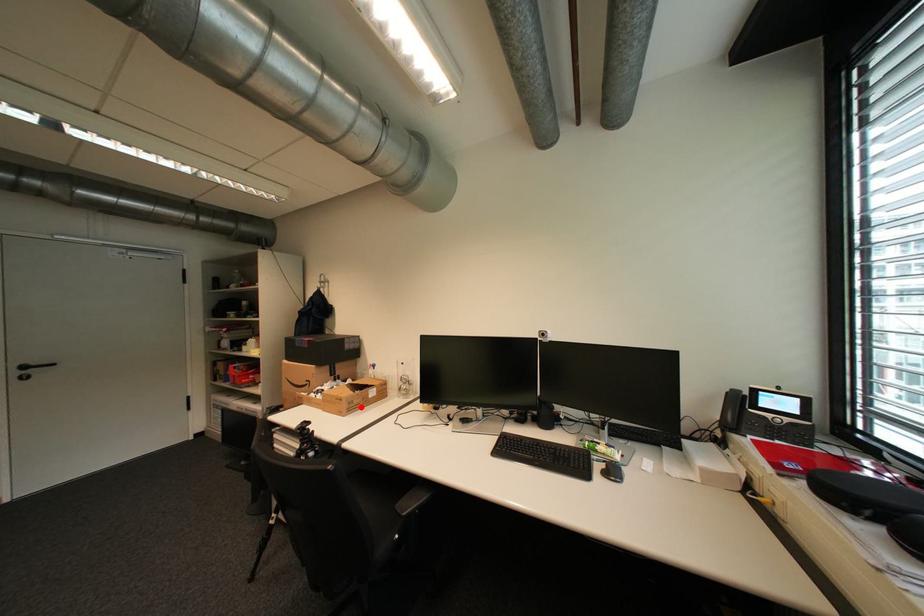
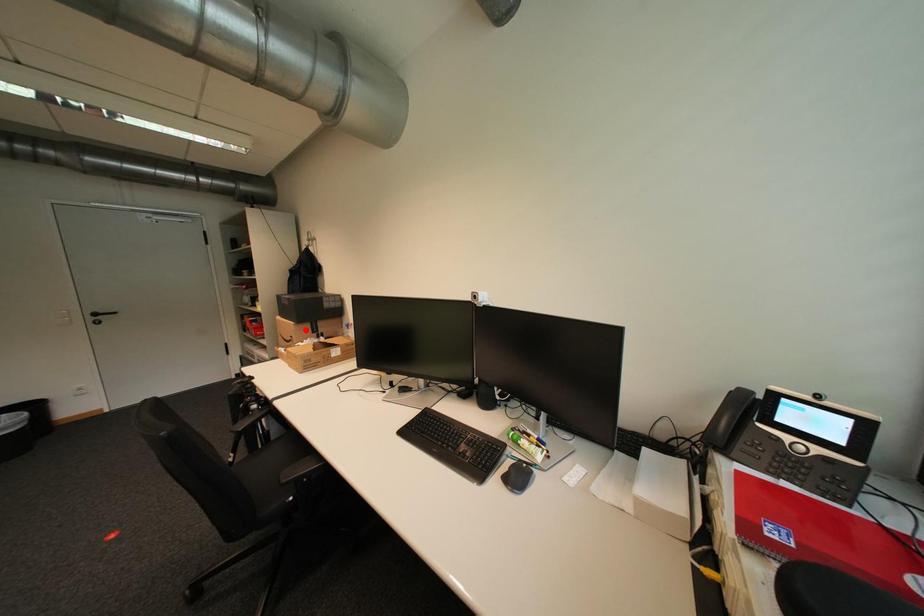
I am providing you with two images of the same scene from different viewpoints. A red point is marked on the first image and another point is marked on the second image. Is the red point in image1 aligned with the point shown in image2?

No